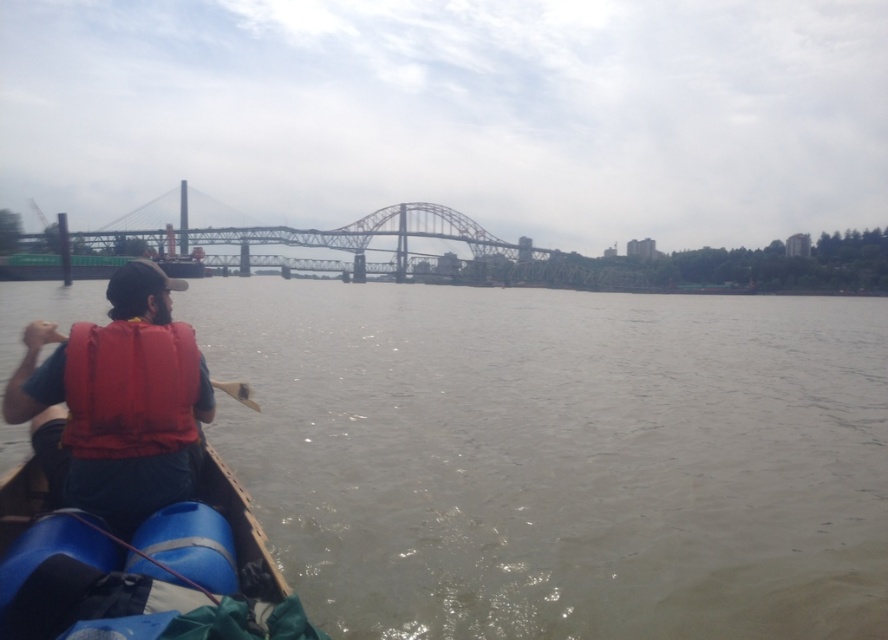
Question: Considering the relative positions of brown muddy water at lower left and red matte life jacket at left in the image provided, where is brown muddy water at lower left located with respect to red matte life jacket at left?

Choices:
 (A) left
 (B) right

Answer: (B)

Question: Which object is the closest to the red matte life jacket at left?

Choices:
 (A) matte orange life vest at lower left
 (B) blue rubber boat at lower left
 (C) brown muddy water at lower left
 (D) wooden paddle at center

Answer: (A)

Question: Which of these objects is positioned farthest from the wooden paddle at center?

Choices:
 (A) brown muddy water at lower left
 (B) blue rubber boat at lower left
 (C) matte orange life vest at lower left

Answer: (A)

Question: Which point is closer to the camera?

Choices:
 (A) (105, 464)
 (B) (236, 381)
 (C) (100, 404)

Answer: (A)

Question: In this image, where is blue rubber boat at lower left located relative to matte orange life vest at lower left?

Choices:
 (A) above
 (B) below

Answer: (B)

Question: Can you confirm if blue rubber boat at lower left is positioned to the right of red matte life jacket at left?

Choices:
 (A) yes
 (B) no

Answer: (A)